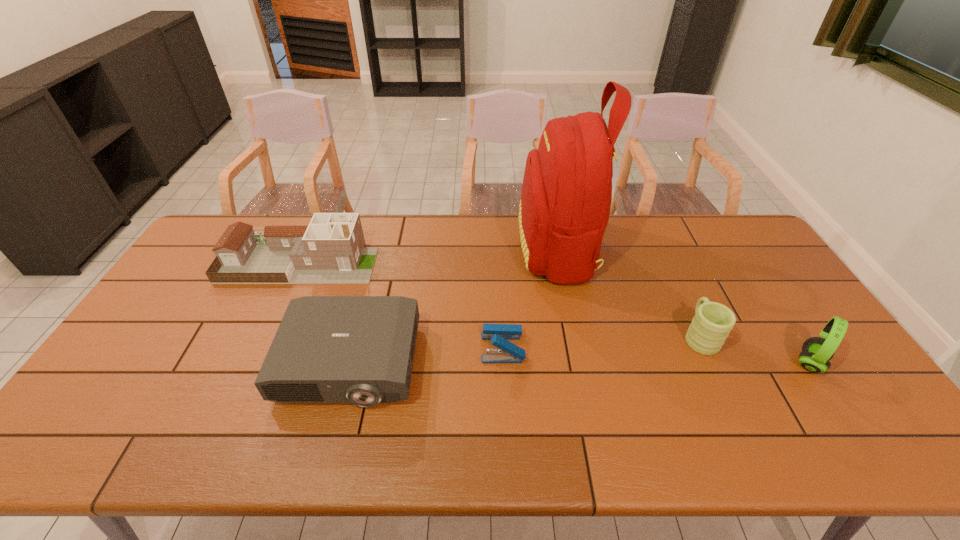
The height and width of the screenshot is (540, 960). Find the location of `the tallest object`. the tallest object is located at coordinates (566, 196).

I want to click on backpack, so click(x=566, y=196).

The height and width of the screenshot is (540, 960). I want to click on dollhouse, so click(x=330, y=250).

Locate an element on the screen. The height and width of the screenshot is (540, 960). headset is located at coordinates coord(816,352).

You are a GUI agent. You are given a task and a screenshot of the screen. Output one action in this format:
    pyautogui.click(x=<x>, y=<y>)
    Task: Click on the second object from right to left
    
    Given the screenshot: What is the action you would take?
    pyautogui.click(x=712, y=323)

I want to click on projector, so [x=328, y=349].

You are a GUI agent. You are given a task and a screenshot of the screen. Output one action in this format:
    pyautogui.click(x=<x>, y=<y>)
    Task: Click on the third object from left to right
    Image resolution: width=960 pixels, height=540 pixels.
    Given the screenshot: What is the action you would take?
    pyautogui.click(x=499, y=334)

You are a GUI agent. You are given a task and a screenshot of the screen. Output one action in this format:
    pyautogui.click(x=<x>, y=<y>)
    Task: Click on the shortest object
    Image resolution: width=960 pixels, height=540 pixels.
    Given the screenshot: What is the action you would take?
    pyautogui.click(x=499, y=334)

The image size is (960, 540). Identify the location of free region located 0.070m on the front-facing side of the backpack. (497, 248).

In order to click on vacant space situated 0.360m on the front-facing side of the backpack in this screenshot , I will do 413,248.